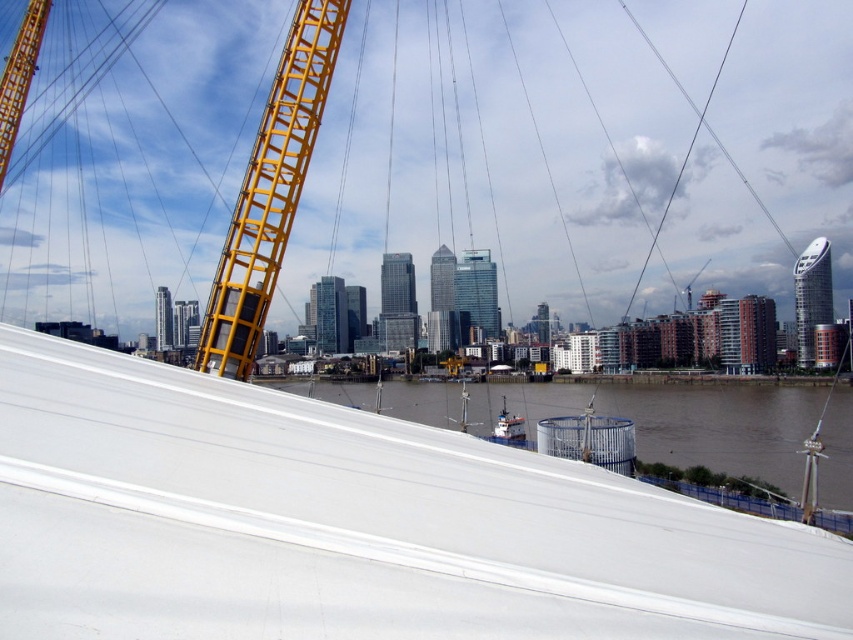
Question: Is brown matte water at lower center wider than yellow metallic structure at left?

Choices:
 (A) no
 (B) yes

Answer: (B)

Question: Is yellow metallic structure at left positioned in front of yellow metallic crane at upper left?

Choices:
 (A) no
 (B) yes

Answer: (B)

Question: Among these points, which one is nearest to the camera?

Choices:
 (A) (781, 422)
 (B) (3, 150)

Answer: (A)

Question: Estimate the real-world distances between objects in this image. Which object is farther from the yellow metallic structure at left?

Choices:
 (A) yellow metallic crane at upper left
 (B) brown matte water at lower center

Answer: (A)

Question: Which object appears farthest from the camera in this image?

Choices:
 (A) brown matte water at lower center
 (B) yellow metallic structure at left

Answer: (B)

Question: Is brown matte water at lower center below yellow metallic crane at upper left?

Choices:
 (A) yes
 (B) no

Answer: (A)